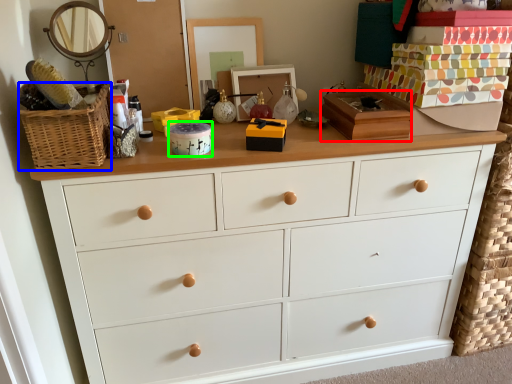
Question: Estimate the real-world distances between objects in this image. Which object is closer to box (highlighted by a red box), basket (highlighted by a blue box) or box (highlighted by a green box)?

Choices:
 (A) basket
 (B) box

Answer: (B)